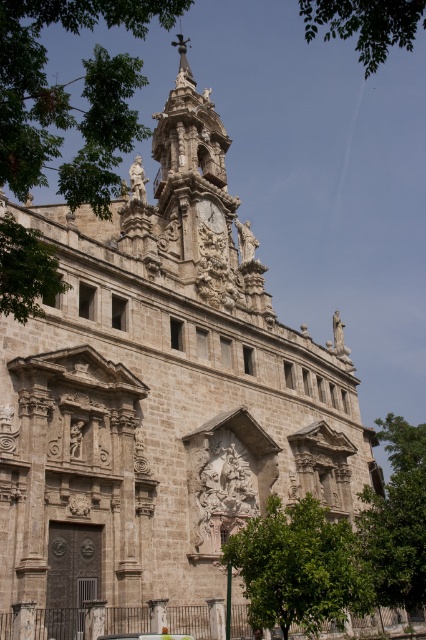
Who is taller, green leafy tree at upper left or metallic car at lower center?

Standing taller between the two is green leafy tree at upper left.

Is green leafy tree at upper left bigger than metallic car at lower center?

Yes.

Which is behind, point (103, 12) or point (141, 634)?

The point (141, 634) is behind.

Find the location of `green leafy tree at upper left`. green leafy tree at upper left is located at coordinates (69, 96).

Between green leafy tree at lower center and green leafy tree at upper right, which one has less height?

With less height is green leafy tree at lower center.

Between green leafy tree at lower center and green leafy tree at upper right, which one appears on the right side from the viewer's perspective?

From the viewer's perspective, green leafy tree at upper right appears more on the right side.

Where is `green leafy tree at lower center`? This screenshot has height=640, width=426. green leafy tree at lower center is located at coordinates (299, 566).

This screenshot has width=426, height=640. Identify the location of green leafy tree at lower center. (299, 566).

Who is higher up, green leafy tree at upper left or green leafy tree at lower center?

green leafy tree at upper left is above.

Is point (143, 32) closer to camera compared to point (305, 536)?

Yes, point (143, 32) is in front of point (305, 536).

This screenshot has width=426, height=640. Identify the location of green leafy tree at upper left. (69, 96).